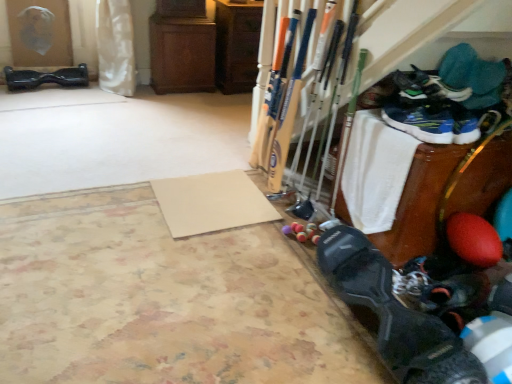
What is the approximate height of black matte shoe at lower right, the first footwear in the front-to-back sequence?

It is 9.59 inches.

What do you see at coordinates (446, 98) in the screenshot? This screenshot has width=512, height=384. I see `blue synthetic shoe at upper right, the fifth footwear when ordered from front to back` at bounding box center [446, 98].

Find the location of `beige matte yoga mat at center, which is the second yoga mat from front to back`. beige matte yoga mat at center, which is the second yoga mat from front to back is located at coordinates (211, 203).

The height and width of the screenshot is (384, 512). What do you see at coordinates (237, 45) in the screenshot?
I see `wooden cricket bats at center` at bounding box center [237, 45].

This screenshot has width=512, height=384. What do you see at coordinates (431, 125) in the screenshot?
I see `blue mesh sneakers at lower right, the third footwear when ordered from back to front` at bounding box center [431, 125].

You are a GUI agent. You are given a task and a screenshot of the screen. Output one action in this format:
    pyautogui.click(x=<x>, y=<y>)
    Task: Click on the black matte shoe at lower right, which appears as the 2th footwear when viewed from the left
    Image resolution: width=512 pixels, height=384 pixels.
    Given the screenshot: What is the action you would take?
    pyautogui.click(x=393, y=314)

This screenshot has height=384, width=512. Find the location of `furniture lying on the left of black matte shoe at lower right, marked as the 5th footwear in a top-to-bottom arrangement`. furniture lying on the left of black matte shoe at lower right, marked as the 5th footwear in a top-to-bottom arrangement is located at coordinates (237, 45).

In the scene shown: From the image's perspective, is black matte shoe at lower right, marked as the 2th footwear in a right-to-left arrangement, above or below wooden cricket bats at center?

black matte shoe at lower right, marked as the 2th footwear in a right-to-left arrangement, is situated lower than wooden cricket bats at center in the image.

Relative to wooden cricket bats at center, is black matte shoe at lower right, arranged as the 2th footwear when ordered from the bottom, in front or behind?

black matte shoe at lower right, arranged as the 2th footwear when ordered from the bottom, is positioned closer to the viewer than wooden cricket bats at center.

How much distance is there between black matte shoe at lower right, which is counted as the 2th footwear, starting from the front, and wooden cricket bats at center?

A distance of 2.39 meters exists between black matte shoe at lower right, which is counted as the 2th footwear, starting from the front, and wooden cricket bats at center.

Is blue synthetic shoe at upper right, the fifth footwear when ordered from front to back, at the back of green suede sneakers at upper right, which is the 4th footwear from right to left?

Yes, green suede sneakers at upper right, which is the 4th footwear from right to left,'s orientation is away from blue synthetic shoe at upper right, the fifth footwear when ordered from front to back.

How far apart are green suede sneakers at upper right, which is counted as the third footwear, starting from the top, and blue synthetic shoe at upper right, the fifth footwear when ordered from front to back?

green suede sneakers at upper right, which is counted as the third footwear, starting from the top, and blue synthetic shoe at upper right, the fifth footwear when ordered from front to back, are 2.19 inches apart from each other.

The image size is (512, 384). I want to click on footwear that is above the green suede sneakers at upper right, which is the 3th footwear from front to back (from a real-world perspective), so click(446, 98).

Is green suede sneakers at upper right, acting as the third footwear starting from the left, far away from blue synthetic shoe at upper right, the 5th footwear ordered from the bottom?

Actually, green suede sneakers at upper right, acting as the third footwear starting from the left, and blue synthetic shoe at upper right, the 5th footwear ordered from the bottom, are a little close together.

Looking at this image, between blue synthetic shoe at upper right, arranged as the 2th footwear when viewed from the top, and black matte shoe at lower right, arranged as the 2th footwear when ordered from the bottom, which one has less height?

black matte shoe at lower right, arranged as the 2th footwear when ordered from the bottom, is shorter.

From a real-world perspective, which is physically above, blue synthetic shoe at upper right, arranged as the 2th footwear when viewed from the top, or black matte shoe at lower right, positioned as the 5th footwear in back-to-front order?

blue synthetic shoe at upper right, arranged as the 2th footwear when viewed from the top, is physically above.

Is blue synthetic shoe at upper right, arranged as the 2th footwear when viewed from the back, closer to the viewer compared to black matte shoe at lower right, which is counted as the 2th footwear, starting from the front?

No, it is behind black matte shoe at lower right, which is counted as the 2th footwear, starting from the front.

Is blue synthetic shoe at upper right, marked as the first footwear in a right-to-left arrangement, thinner than black matte shoe at lower right, marked as the 5th footwear in a top-to-bottom arrangement?

Indeed, blue synthetic shoe at upper right, marked as the first footwear in a right-to-left arrangement, has a lesser width compared to black matte shoe at lower right, marked as the 5th footwear in a top-to-bottom arrangement.

Could you tell me if beige textured yoga mat at lower left, the 1th yoga mat when ordered from front to back, is turned towards green suede sneakers at upper right, which is the 3th footwear from front to back?

No, beige textured yoga mat at lower left, the 1th yoga mat when ordered from front to back, is not facing towards green suede sneakers at upper right, which is the 3th footwear from front to back.

Considering the relative sizes of beige textured yoga mat at lower left, the 1th yoga mat when ordered from front to back, and green suede sneakers at upper right, acting as the fourth footwear starting from the bottom, in the image provided, is beige textured yoga mat at lower left, the 1th yoga mat when ordered from front to back, taller than green suede sneakers at upper right, acting as the fourth footwear starting from the bottom,?

No.

What's the angular difference between beige textured yoga mat at lower left, which is the 2th yoga mat from back to front, and green suede sneakers at upper right, acting as the third footwear starting from the left,'s facing directions?

The angular difference between beige textured yoga mat at lower left, which is the 2th yoga mat from back to front, and green suede sneakers at upper right, acting as the third footwear starting from the left, is 1.02 degrees.

Does point (215, 372) appear closer or farther from the camera than point (432, 77)?

Point (215, 372).

Is beige textured yoga mat at lower left, which is the 2th yoga mat from back to front, behind blue synthetic shoe at upper right, placed as the sixth footwear when sorted from left to right?

No.

Looking at this image, from a real-world perspective, which is physically above, beige textured yoga mat at lower left, which is the 2th yoga mat from back to front, or blue synthetic shoe at upper right, marked as the first footwear in a right-to-left arrangement?

blue synthetic shoe at upper right, marked as the first footwear in a right-to-left arrangement, is physically above.

Is blue synthetic shoe at upper right, arranged as the 2th footwear when viewed from the back, at the back of beige textured yoga mat at lower left, the 1th yoga mat when ordered from front to back?

No.

Does beige textured yoga mat at lower left, the 1th yoga mat when ordered from front to back, touch blue synthetic shoe at upper right, arranged as the 2th footwear when viewed from the top?

They are not placed beside each other.

From a real-world perspective, relative to beige textured yoga mat at lower left, the 1th yoga mat when ordered from front to back, is blue mesh sneakers at lower right, which is the 3th footwear in bottom-to-top order, vertically above or below?

From a real-world perspective, blue mesh sneakers at lower right, which is the 3th footwear in bottom-to-top order, is physically above beige textured yoga mat at lower left, the 1th yoga mat when ordered from front to back.

Identify the location of the 2nd yoga mat below the blue mesh sneakers at lower right, which ranks as the 3th footwear in right-to-left order (from the image's perspective). (162, 299).

Does point (450, 142) appear closer or farther from the camera than point (13, 239)?

Point (450, 142) appears to be closer to the viewer than point (13, 239).

Is blue mesh sneakers at lower right, which is the 4th footwear in left-to-right order, bigger than beige textured yoga mat at lower left, the 1th yoga mat when ordered from front to back?

Actually, blue mesh sneakers at lower right, which is the 4th footwear in left-to-right order, might be smaller than beige textured yoga mat at lower left, the 1th yoga mat when ordered from front to back.

Is point (18, 84) behind point (454, 98)?

Yes.

Is matte black hoverboard at left, which is the 1th footwear from back to front, looking in the opposite direction of green suede sneakers at upper right, acting as the fourth footwear starting from the bottom?

No, matte black hoverboard at left, which is the 1th footwear from back to front,'s orientation is not away from green suede sneakers at upper right, acting as the fourth footwear starting from the bottom.

From the image's perspective, is matte black hoverboard at left, which is the sixth footwear in front-to-back order, above green suede sneakers at upper right, which is the 4th footwear from right to left?

Indeed, from the image's perspective, matte black hoverboard at left, which is the sixth footwear in front-to-back order, is shown above green suede sneakers at upper right, which is the 4th footwear from right to left.

How different are the orientations of matte black hoverboard at left, which is the sixth footwear in front-to-back order, and green suede sneakers at upper right, acting as the fourth footwear starting from the bottom, in degrees?

94.4 degrees separate the facing orientations of matte black hoverboard at left, which is the sixth footwear in front-to-back order, and green suede sneakers at upper right, acting as the fourth footwear starting from the bottom.

Locate an element on the screen. furniture that appears on the left of black matte shoe at lower right, marked as the 5th footwear in a top-to-bottom arrangement is located at coordinates (237, 45).

You are a GUI agent. You are given a task and a screenshot of the screen. Output one action in this format:
    pyautogui.click(x=<x>, y=<y>)
    Task: Click on the footwear that is the 2nd object located in front of the blue synthetic shoe at upper right, the fifth footwear when ordered from front to back
    The width and height of the screenshot is (512, 384).
    Given the screenshot: What is the action you would take?
    pyautogui.click(x=426, y=86)

Estimate the real-world distances between objects in this image. Which object is closer to matte black hoverboard at left, which appears as the 6th footwear when viewed from the right, blue synthetic shoe at upper right, placed as the sixth footwear when sorted from left to right, or wooden cricket bats at center?

wooden cricket bats at center.

Looking at the image, which one is located further to blue synthetic shoe at upper right, marked as the first footwear in a right-to-left arrangement, black matte shoe at lower right, which appears as the 5th footwear when viewed from the left, or green suede sneakers at upper right, which is counted as the third footwear, starting from the top?

Among the two, black matte shoe at lower right, which appears as the 5th footwear when viewed from the left, is located further to blue synthetic shoe at upper right, marked as the first footwear in a right-to-left arrangement.

When comparing their distances from green suede sneakers at upper right, acting as the fourth footwear starting from the bottom, does beige textured yoga mat at lower left, the 1th yoga mat when ordered from front to back, or wooden cricket bats at center seem closer?

Among the two, beige textured yoga mat at lower left, the 1th yoga mat when ordered from front to back, is located nearer to green suede sneakers at upper right, acting as the fourth footwear starting from the bottom.

Considering their positions, is matte black hoverboard at left, which is the sixth footwear in front-to-back order, positioned closer to blue mesh sneakers at lower right, the 4th footwear from the top, than beige matte yoga mat at center, which is the second yoga mat from front to back?

Based on the image, beige matte yoga mat at center, which is the second yoga mat from front to back, appears to be nearer to blue mesh sneakers at lower right, the 4th footwear from the top.

When comparing their distances from wooden cricket bats at center, does matte black hoverboard at left, which appears as the 6th footwear when viewed from the right, or black matte shoe at lower right, the 6th footwear positioned from the top, seem closer?

matte black hoverboard at left, which appears as the 6th footwear when viewed from the right.

Considering their positions, is black matte shoe at lower right, marked as the 2th footwear in a right-to-left arrangement, positioned closer to blue synthetic shoe at upper right, the 5th footwear ordered from the bottom, than black matte shoe at lower right, placed as the sixth footwear when sorted from back to front?

Among the two, black matte shoe at lower right, marked as the 2th footwear in a right-to-left arrangement, is located nearer to blue synthetic shoe at upper right, the 5th footwear ordered from the bottom.

Which object lies nearer to the anchor point black matte shoe at lower right, which appears as the 5th footwear when viewed from the left, beige matte yoga mat at center, which is counted as the 1th yoga mat, starting from the back, or matte black hoverboard at left, which is the 1th footwear from back to front?

The object closer to black matte shoe at lower right, which appears as the 5th footwear when viewed from the left, is beige matte yoga mat at center, which is counted as the 1th yoga mat, starting from the back.

When comparing their distances from black matte shoe at lower right, which appears as the 2th footwear when viewed from the left, does wooden cricket bats at center or matte black hoverboard at left, which ranks as the 1th footwear in left-to-right order, seem further?

The object further to black matte shoe at lower right, which appears as the 2th footwear when viewed from the left, is matte black hoverboard at left, which ranks as the 1th footwear in left-to-right order.

This screenshot has width=512, height=384. In order to click on yoga mat between beige textured yoga mat at lower left, which is the 2th yoga mat from back to front, and black matte shoe at lower right, positioned as the 5th footwear in back-to-front order, from left to right in this screenshot , I will do `click(211, 203)`.

Locate an element on the screen. Image resolution: width=512 pixels, height=384 pixels. yoga mat between beige textured yoga mat at lower left, which is the 2th yoga mat from back to front, and blue synthetic shoe at upper right, arranged as the 2th footwear when viewed from the back, in the horizontal direction is located at coordinates (211, 203).

Where is `yoga mat positioned between black matte shoe at lower right, which appears as the 2th footwear when viewed from the left, and wooden cricket bats at center from near to far`? yoga mat positioned between black matte shoe at lower right, which appears as the 2th footwear when viewed from the left, and wooden cricket bats at center from near to far is located at coordinates (211, 203).

This screenshot has height=384, width=512. Find the location of `yoga mat between beige textured yoga mat at lower left, the 1th yoga mat when ordered from front to back, and green suede sneakers at upper right, acting as the third footwear starting from the left, from left to right`. yoga mat between beige textured yoga mat at lower left, the 1th yoga mat when ordered from front to back, and green suede sneakers at upper right, acting as the third footwear starting from the left, from left to right is located at coordinates (211, 203).